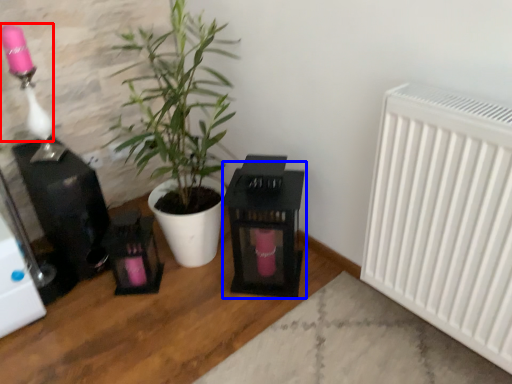
Question: Which object appears farthest to the camera in this image, lamp (highlighted by a red box) or table (highlighted by a blue box)?

Choices:
 (A) lamp
 (B) table

Answer: (B)